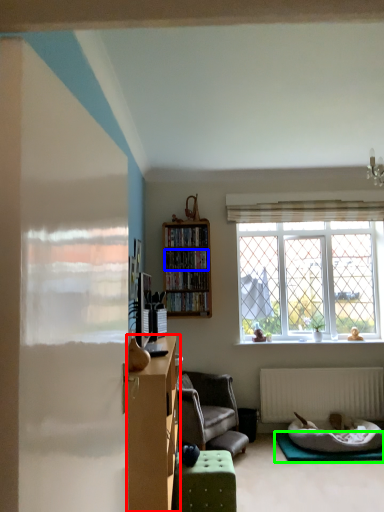
Question: Estimate the real-world distances between objects in this image. Which object is farther from cabinetry (highlighted by a red box), cabinet (highlighted by a blue box) or yoga mat (highlighted by a green box)?

Choices:
 (A) cabinet
 (B) yoga mat

Answer: (A)